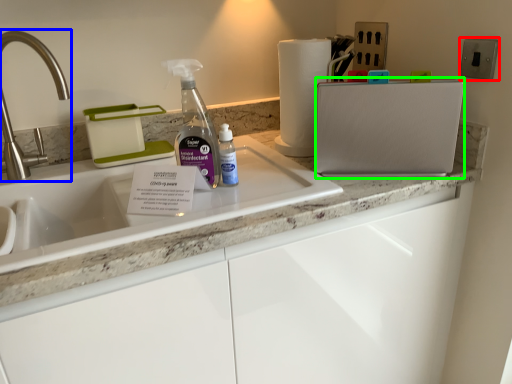
Question: Which object is positioned farthest from electric outlet (highlighted by a red box)? Select from tap (highlighted by a blue box) and appliance (highlighted by a green box).

Choices:
 (A) tap
 (B) appliance

Answer: (A)